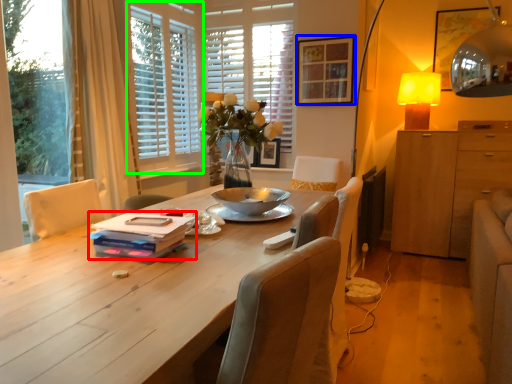
Question: Based on their relative distances, which object is farther from book (highlighted by a red box)? Choose from picture frame (highlighted by a blue box) and window frame (highlighted by a green box).

Choices:
 (A) picture frame
 (B) window frame

Answer: (A)